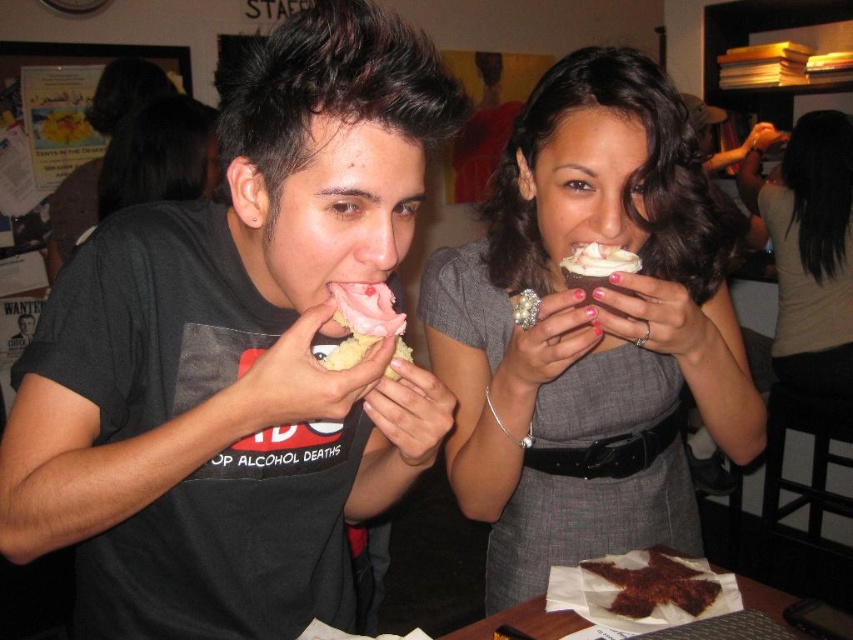
Based on the scene description, where is the gray fabric dress at center positioned in the image?

The gray fabric dress at center is located at point (809, 252) in the image.

You are a photographer at the event and need to adjust your camera focus. Which object is closer to the camera between the gray fabric dress at center and the white creamy frosting at center?

The gray fabric dress at center is above the white creamy frosting at center, so it is closer to the camera.